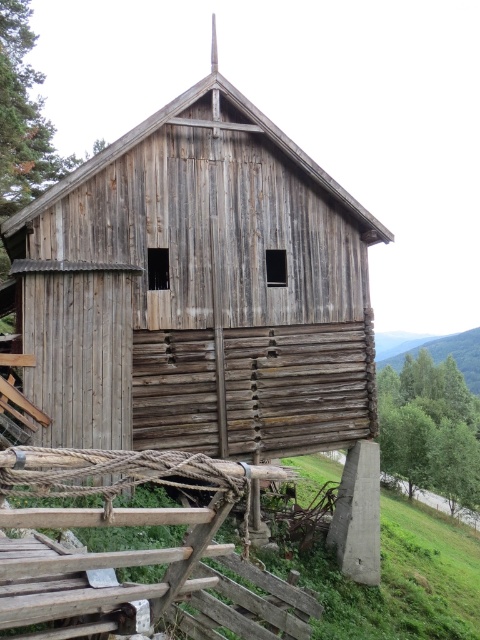
The height and width of the screenshot is (640, 480). Identify the location of weathered wood barn at center. (193, 292).

Does weathered wood barn at center appear on the left side of rustic wooden fence at lower left?

Correct, you'll find weathered wood barn at center to the left of rustic wooden fence at lower left.

Which is behind, point (54, 381) or point (204, 465)?

Point (54, 381)

Image resolution: width=480 pixels, height=640 pixels. Find the location of `weathered wood barn at center`. weathered wood barn at center is located at coordinates (193, 292).

Who is lower down, rustic wooden fence at lower left or green leafy hillside at upper right?

green leafy hillside at upper right is below.

Does point (210, 580) lie behind point (456, 339)?

No, it is in front of (456, 339).

Locate an element on the screen. rustic wooden fence at lower left is located at coordinates (136, 557).

Is weathered wood barn at center shorter than green leafy hillside at upper right?

In fact, weathered wood barn at center may be taller than green leafy hillside at upper right.

Which is in front, point (319, 396) or point (478, 387)?

Point (319, 396) is more forward.

At what (x,y) coordinates should I click in order to perform the action: click on weathered wood barn at center. Please return your answer as a coordinate pair (x, y). The width and height of the screenshot is (480, 640). Looking at the image, I should click on (193, 292).